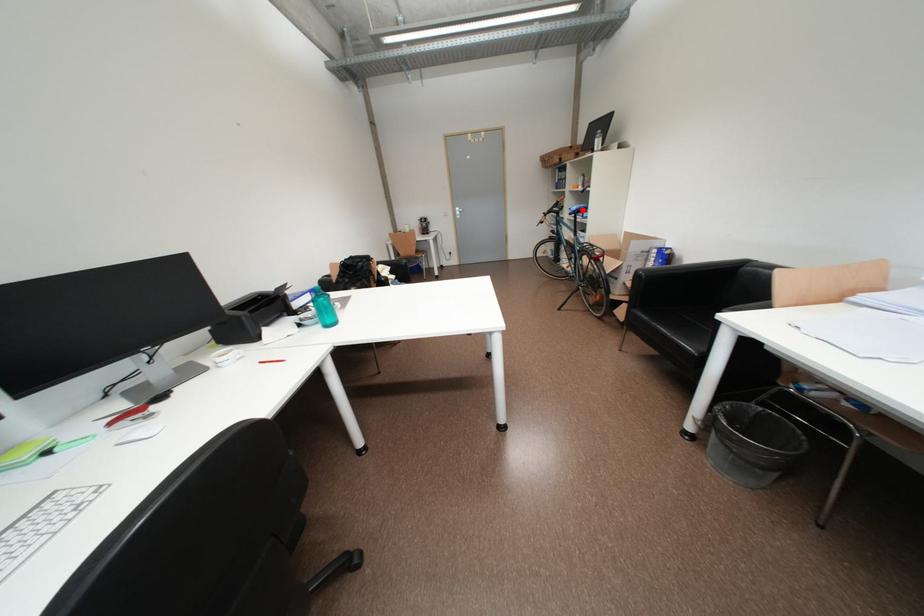
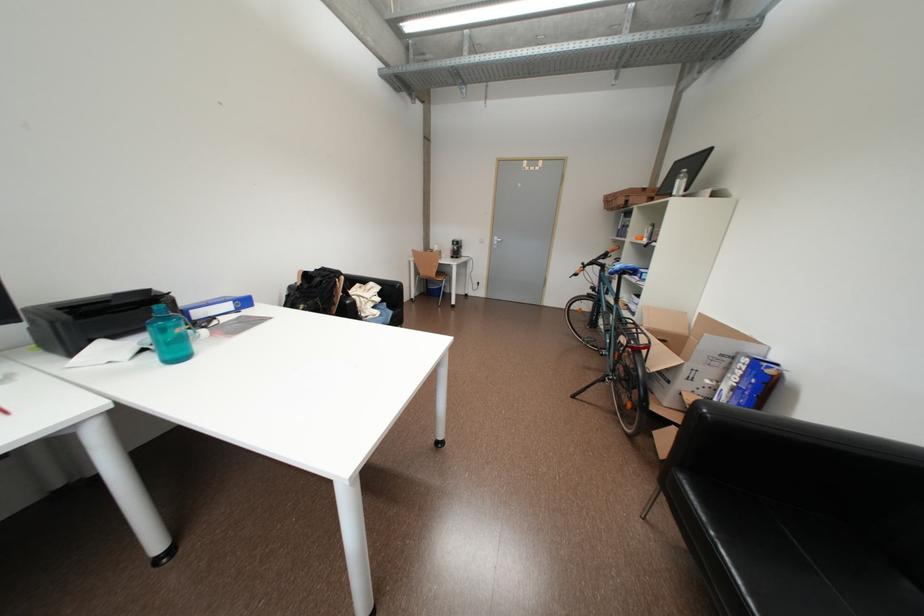
Question: I am providing you with two images of the same scene from different viewpoints. Image1 has a red point marked. In image2, the corresponding 3D location appears at what relative position? Reply with the corresponding letter.

Choices:
 (A) Closer
 (B) Farther

Answer: (B)